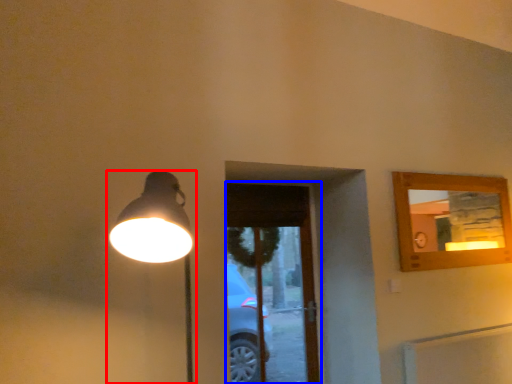
Question: Which object is closer to the camera taking this photo, lamp (highlighted by a red box) or screen door (highlighted by a blue box)?

Choices:
 (A) lamp
 (B) screen door

Answer: (A)